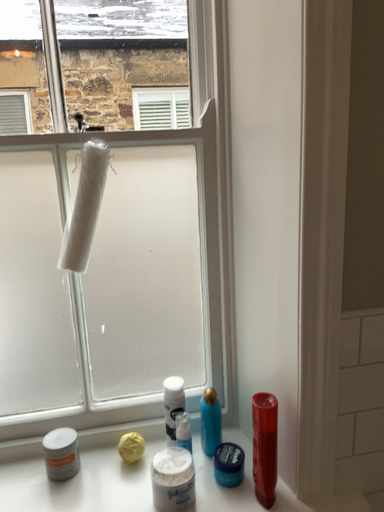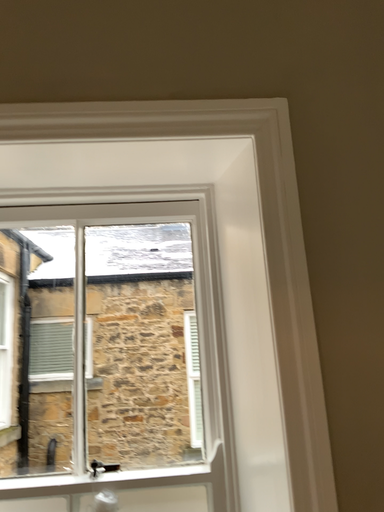
Question: Which way did the camera rotate in the video?

Choices:
 (A) rotated upward
 (B) rotated downward

Answer: (A)